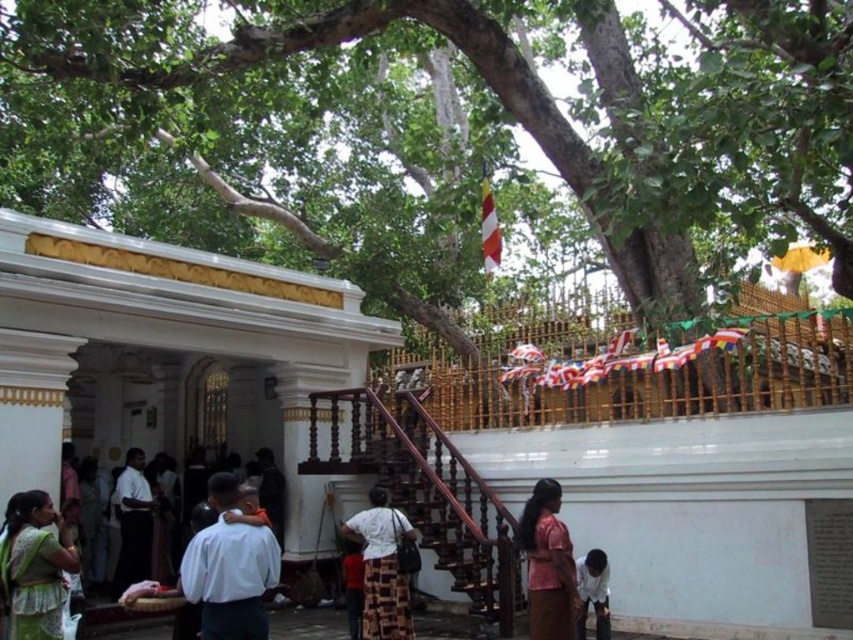
Does brown wooden stairs at center have a greater width compared to dark gray shirt at center?

Yes.

Who is shorter, brown wooden stairs at center or dark gray shirt at center?

With less height is dark gray shirt at center.

Describe the element at coordinates (451, 515) in the screenshot. I see `brown wooden stairs at center` at that location.

The image size is (853, 640). Find the location of `brown wooden stairs at center`. brown wooden stairs at center is located at coordinates click(451, 515).

The width and height of the screenshot is (853, 640). Describe the element at coordinates (36, 566) in the screenshot. I see `green fabric saree at lower left` at that location.

What are the coordinates of `green fabric saree at lower left` in the screenshot? It's located at (36, 566).

Which is in front, point (41, 554) or point (138, 452)?

Point (41, 554)

I want to click on green fabric saree at lower left, so click(36, 566).

Can you confirm if brown wooden stairs at center is positioned above matte pink dress at center?

Yes, brown wooden stairs at center is above matte pink dress at center.

This screenshot has width=853, height=640. In order to click on brown wooden stairs at center in this screenshot , I will do `click(451, 515)`.